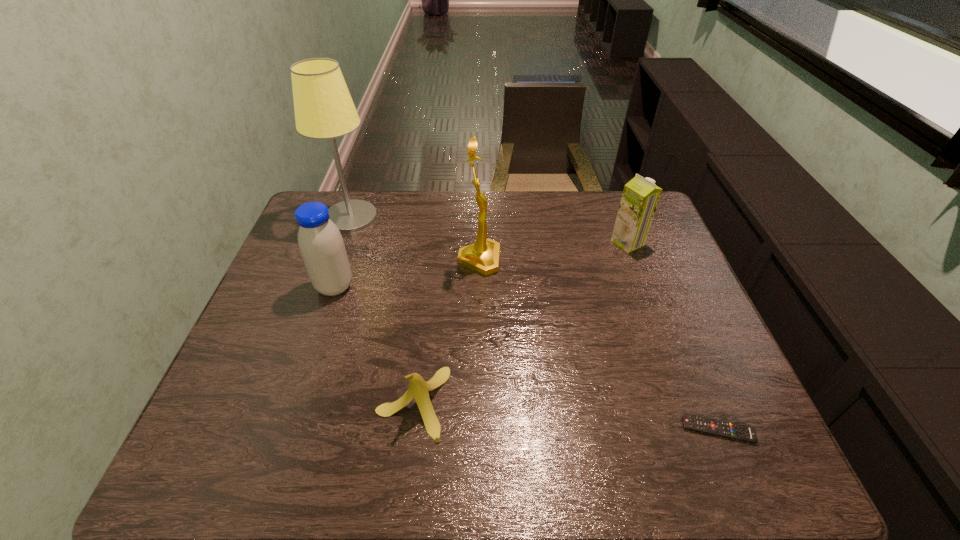
Identify the location of vacant region located on the front of the left soya milk. Image resolution: width=960 pixels, height=540 pixels. (283, 442).

The height and width of the screenshot is (540, 960). Find the location of `vacant space located 0.290m on the left of the farther soya milk`. vacant space located 0.290m on the left of the farther soya milk is located at coordinates (518, 243).

Locate an element on the screen. This screenshot has width=960, height=540. vacant region located on the left of the banana is located at coordinates (319, 403).

The height and width of the screenshot is (540, 960). Find the location of `blank area located on the back of the shortest object`. blank area located on the back of the shortest object is located at coordinates (660, 290).

I want to click on object positioned at the far edge, so click(x=324, y=109).

Find the location of a particular element. This screenshot has height=540, width=960. banana at the near edge is located at coordinates (418, 388).

Find the location of a particular element. remote control situated at the near edge is located at coordinates (x=726, y=429).

I want to click on table lamp at the left edge, so click(x=324, y=109).

Find the location of a particular element. The height and width of the screenshot is (540, 960). soya milk that is positioned at the left edge is located at coordinates (321, 245).

This screenshot has height=540, width=960. In order to click on soya milk present at the right edge in this screenshot , I will do `click(640, 197)`.